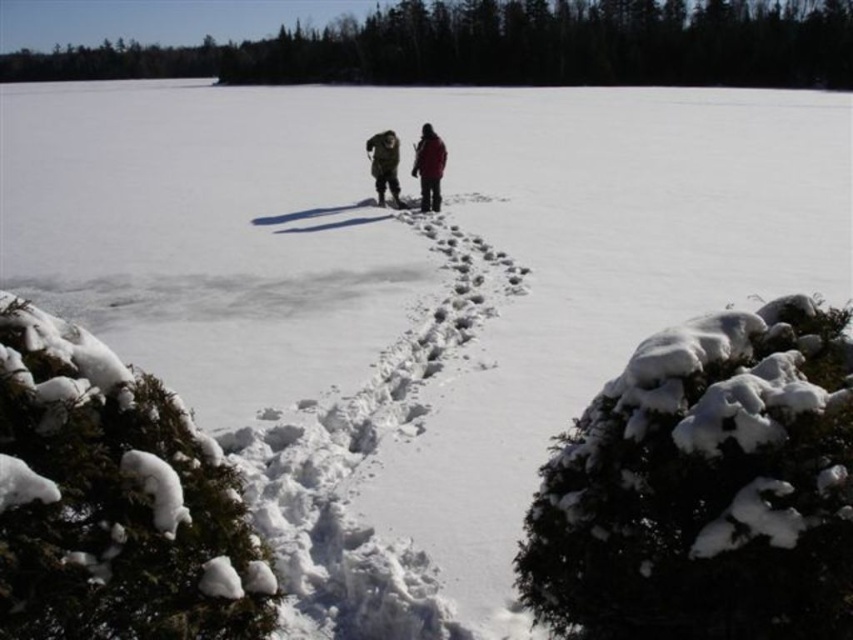
You are standing at the point closest to you in the winter scene. There are two points marked in the image, one at coordinate point (332,458) and the other at point (426,163). Which point should you move towards to get closer to the two walking figures?

Point (426,163) is farther from the viewer than point (332,458). Since you are already at the closest point to you, moving towards point (426,163) would take you closer to the two walking figures because it is further away from your current position.

Consider the image. You are standing at the edge of the snowy field and see the dark brown fur coat at center and the red wool jacket at center. Which person is closer to you?

The dark brown fur coat at center is below the red wool jacket at center, so the dark brown fur coat at center is closer to you.

You are an observer standing near the two evergreen trees in the winter scene. You notice two people walking away from you. One is wearing a dark brown fur coat at center and the other a red wool jacket at center. Which of these two items of clothing appears wider when viewed from your position?

The dark brown fur coat at center appears wider than the red wool jacket at center because its width is larger as described.